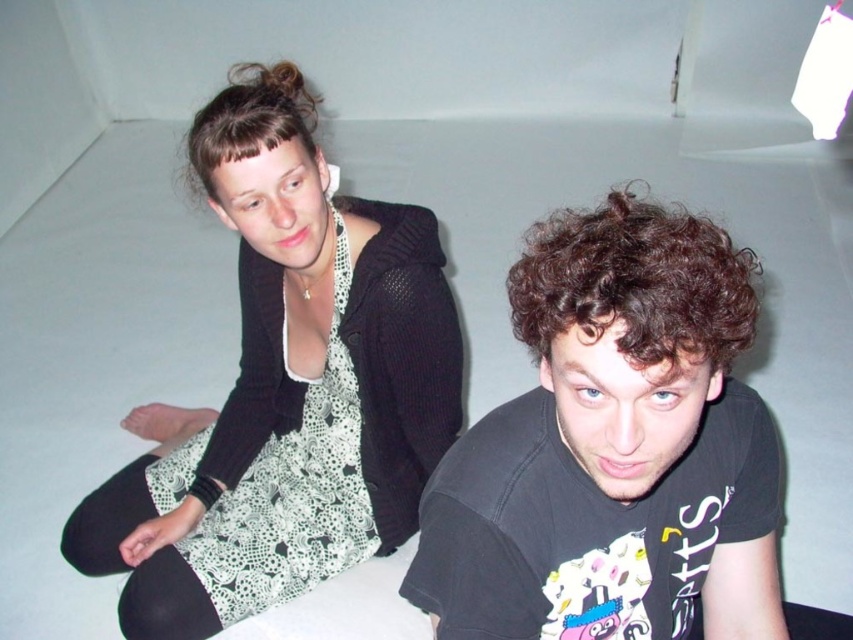
Question: Does black matte t-shirt at center have a larger size compared to white crochet dress at center?

Choices:
 (A) yes
 (B) no

Answer: (B)

Question: Where is black matte t-shirt at center located in relation to white crochet dress at center in the image?

Choices:
 (A) right
 (B) left

Answer: (A)

Question: Which object is closer to the camera taking this photo?

Choices:
 (A) white crochet dress at center
 (B) black matte t-shirt at center

Answer: (B)

Question: Is black matte t-shirt at center smaller than white crochet dress at center?

Choices:
 (A) no
 (B) yes

Answer: (B)

Question: Among these points, which one is farthest from the camera?

Choices:
 (A) (561, 413)
 (B) (305, 108)

Answer: (B)